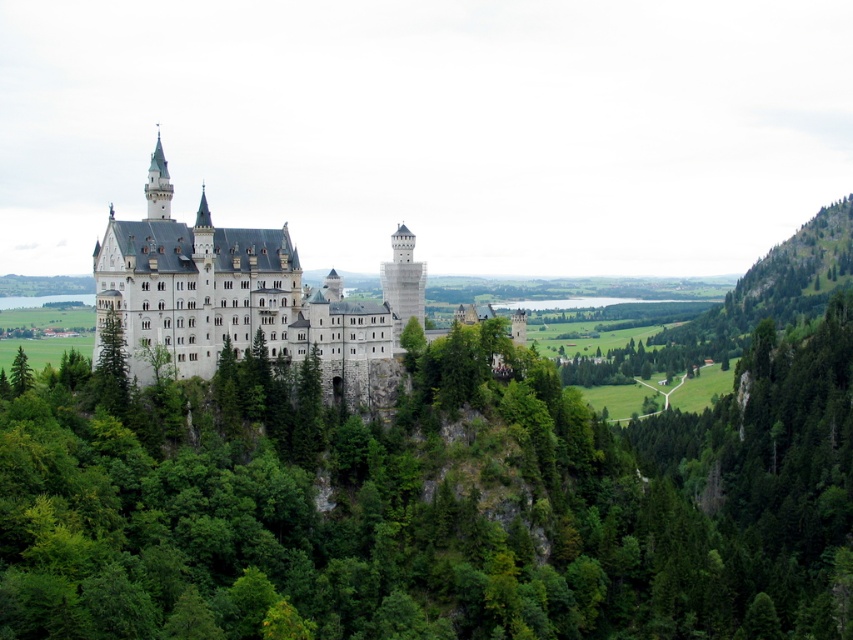
Does white stone castle at center appear under green leafy tree at left?

Incorrect, white stone castle at center is not positioned below green leafy tree at left.

Does white stone castle at center lie in front of green leafy tree at left?

Yes.

You are a GUI agent. You are given a task and a screenshot of the screen. Output one action in this format:
    pyautogui.click(x=<x>, y=<y>)
    Task: Click on the white stone castle at center
    
    Given the screenshot: What is the action you would take?
    pyautogui.click(x=233, y=301)

This screenshot has width=853, height=640. I want to click on white stone castle at center, so click(233, 301).